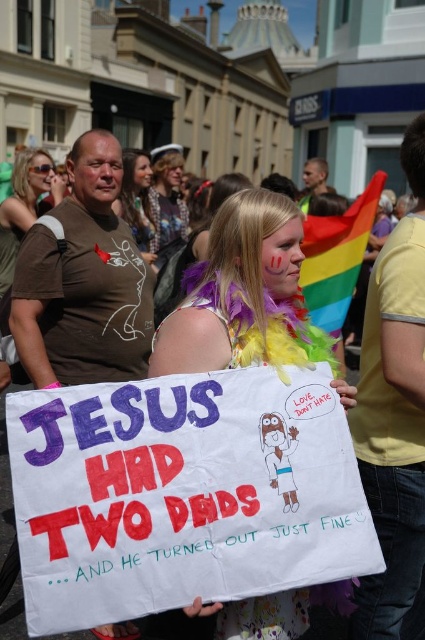
In the scene described, where is the rainbow feather boa at center located relative to the blonde hair at center?

The rainbow feather boa at center is to the right of the blonde hair at center.

You are a photographer trying to capture the entire scene in one shot. You notice two points marked in the image at coordinates point [292,316] and point [133,228]. Considering their positions, which point should you focus on to ensure both points are in sharp focus?

To ensure both points are in sharp focus, you should focus on the point that is closer to the camera, which is point [292,316]. This is because focusing on the closer point maximizes the depth of field, making both points appear sharp.